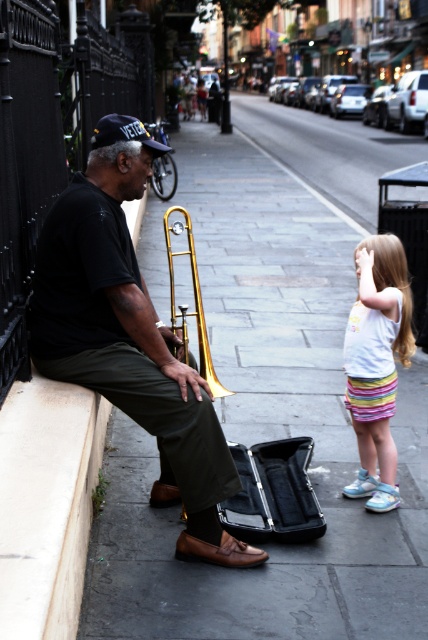
You are standing on the sidewalk and see the dark gray stone pavement at lower left and the pastel striped skirt at lower right. Which object is positioned higher in the image?

The dark gray stone pavement at lower left is located above the pastel striped skirt at lower right, so it is positioned higher in the image.

You are standing on the sidewalk and see two points marked in the image. Which point is closer to you, point (214, 426) or point (23, 436)?

Point (23, 436) is closer to you because it is less further than point (214, 426).

You are a pedestrian walking on the sidewalk and you see the dark gray stone pavement at lower left and the blue denim baseball cap at left. Which object is positioned higher from the ground?

The dark gray stone pavement at lower left is located above the blue denim baseball cap at left, so it is positioned higher from the ground.